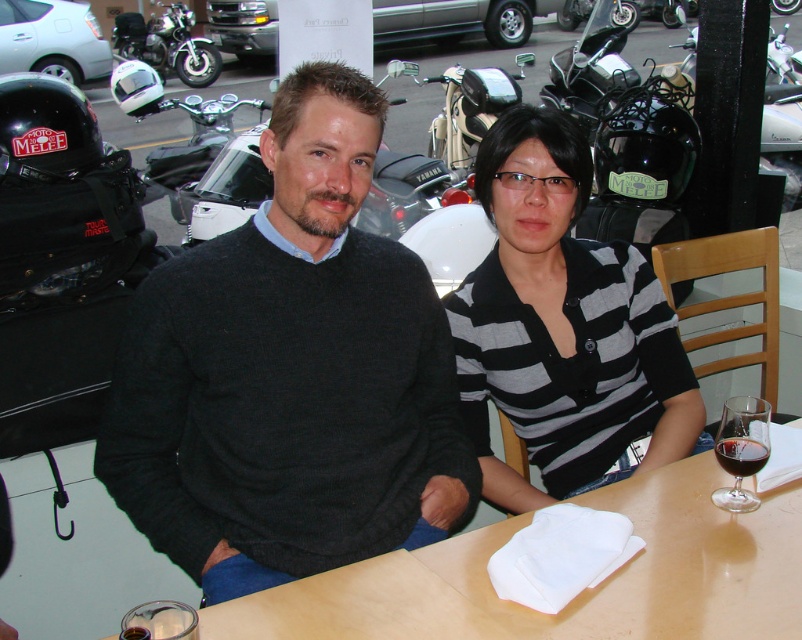
Does point (466, 76) come closer to viewer compared to point (187, 81)?

Yes.

Is beige leather scooter at center behind black metallic motorcycle at upper left?

No, beige leather scooter at center is in front of black metallic motorcycle at upper left.

Does point (444, 148) come closer to viewer compared to point (148, 51)?

Yes, point (444, 148) is closer to viewer.

At what (x,y) coordinates should I click in order to perform the action: click on beige leather scooter at center. Please return your answer as a coordinate pair (x, y). Looking at the image, I should click on (470, 108).

Who is more forward, (x=424, y=435) or (x=794, y=77)?

Point (x=424, y=435)

Does dark gray sweater at center have a larger size compared to shiny black motorcycle at upper right?

No, dark gray sweater at center is not bigger than shiny black motorcycle at upper right.

Describe the element at coordinates (290, 372) in the screenshot. I see `dark gray sweater at center` at that location.

Where is `dark gray sweater at center`? This screenshot has width=802, height=640. dark gray sweater at center is located at coordinates (290, 372).

Does dark gray sweater at center appear on the left side of transparent glass at table right?

Indeed, dark gray sweater at center is positioned on the left side of transparent glass at table right.

Which is behind, point (221, 358) or point (732, 468)?

The point (221, 358) is behind.

Is point (278, 563) farther from viewer compared to point (743, 404)?

Yes, point (278, 563) is farther from viewer.

This screenshot has width=802, height=640. I want to click on dark gray sweater at center, so click(290, 372).